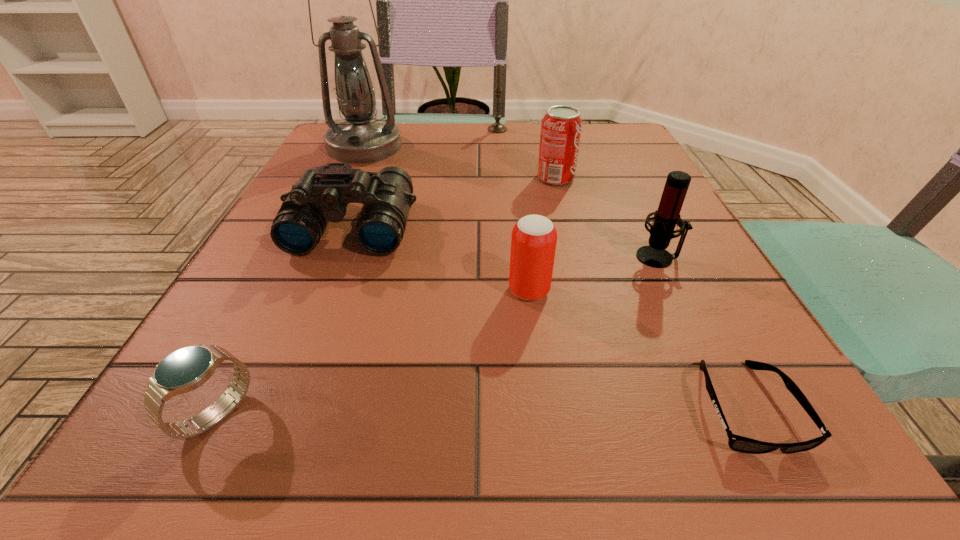
The width and height of the screenshot is (960, 540). What are the coordinates of `oil lamp present at the left edge` in the screenshot? It's located at (360, 139).

At what (x,y) coordinates should I click in order to perform the action: click on binoculars located in the left edge section of the desktop. Please return your answer as a coordinate pair (x, y). The height and width of the screenshot is (540, 960). Looking at the image, I should click on (322, 193).

Locate an element on the screen. watch that is positioned at the left edge is located at coordinates (184, 370).

This screenshot has width=960, height=540. I want to click on microphone positioned at the right edge, so click(654, 255).

Identify the location of sunglasses situated at the right edge. (737, 443).

At what (x,y) coordinates should I click in order to perform the action: click on object that is at the far left corner. Please return your answer as a coordinate pair (x, y). Looking at the image, I should click on (360, 139).

In order to click on object that is at the near left corner in this screenshot , I will do `click(184, 370)`.

Locate an element on the screen. object at the near right corner is located at coordinates click(737, 443).

Locate an element on the screen. The height and width of the screenshot is (540, 960). free space at the far edge is located at coordinates (439, 143).

In the image, there is a desktop. Where is `vacant region at the left edge`? This screenshot has height=540, width=960. vacant region at the left edge is located at coordinates (235, 275).